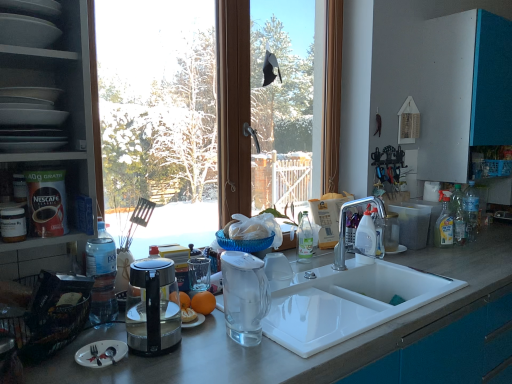
Identify the location of free space in front of yellow liquid bottle at right. This screenshot has height=384, width=512. (463, 254).